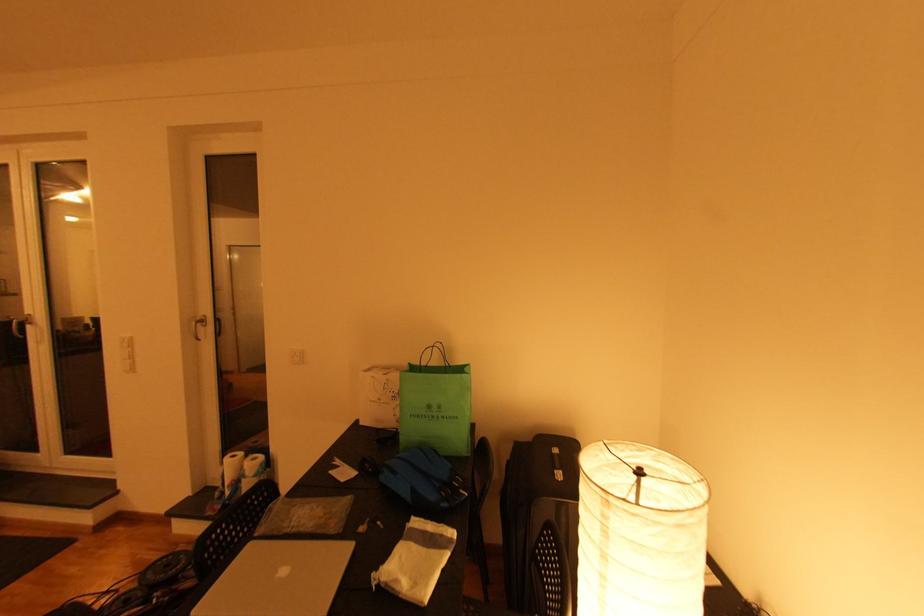
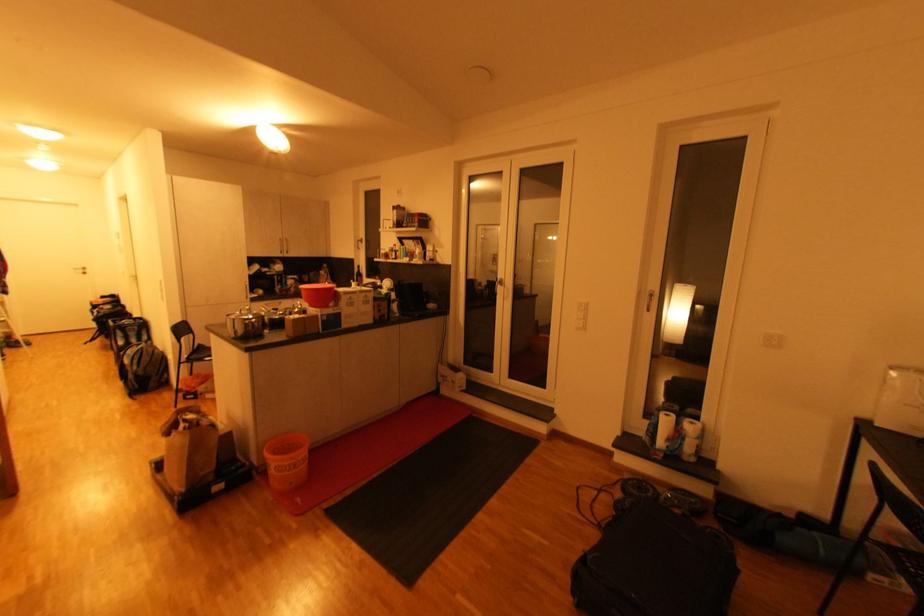
Locate, in the second image, the point that corresponds to (233,493) in the first image.

(665, 444)